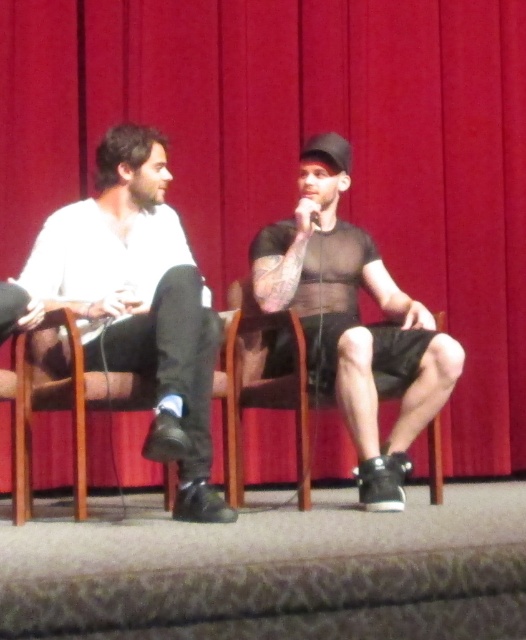
You are a photographer positioned behind the camera, aiming to capture a clear shot of both the matte black shirt at center and the black matte microphone at center. Which object will appear larger in the photo?

The matte black shirt at center will appear larger in the photo because it is much taller than the black matte microphone at center.

You are a stagehand preparing to adjust the lighting for the event. You need to ensure that the matte white shirt at left and the black matte microphone at center are both well illuminated. Given their heights, which object might require a higher light fixture to ensure proper illumination?

The matte white shirt at left is taller than the black matte microphone at center, so the light fixture for the matte white shirt at left should be placed higher to ensure it is properly illuminated.